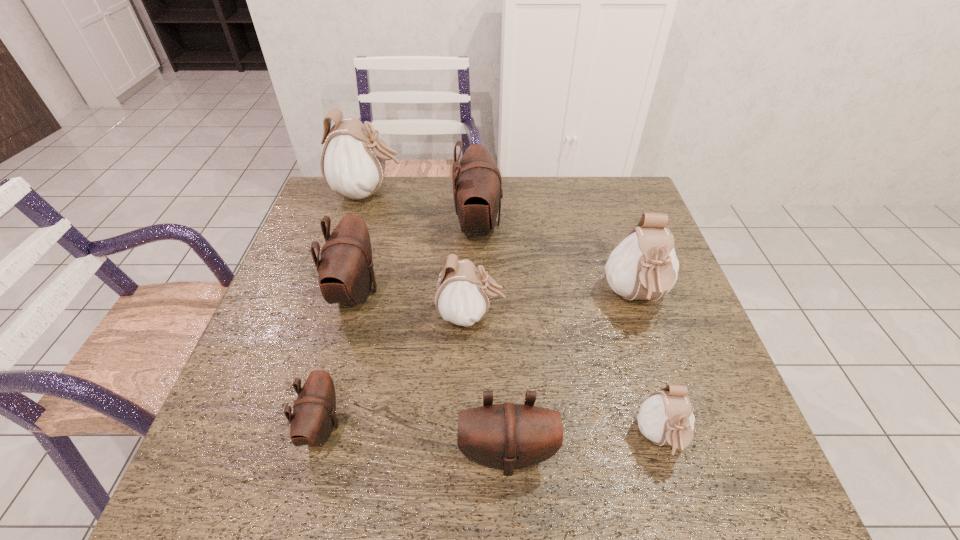
The width and height of the screenshot is (960, 540). I want to click on blank area at the right edge, so click(632, 228).

Where is `free spot at the far left corner of the desktop`? free spot at the far left corner of the desktop is located at coordinates (319, 199).

This screenshot has width=960, height=540. In the image, there is a desktop. Find the location of `blank space at the near right corner`. blank space at the near right corner is located at coordinates (762, 480).

The width and height of the screenshot is (960, 540). I want to click on free space between the nearest white pouch and the third smallest white pouch, so click(648, 368).

In order to click on free area in between the smallest brown pouch and the second farthest brown pouch in this screenshot , I will do `click(339, 359)`.

Locate an element on the screen. free spot between the smallest brown pouch and the third biggest brown pouch is located at coordinates (415, 440).

Locate an element on the screen. The width and height of the screenshot is (960, 540). vacant point located between the leftmost white pouch and the third biggest white pouch is located at coordinates (420, 254).

The height and width of the screenshot is (540, 960). I want to click on free point between the farthest brown pouch and the third smallest white pouch, so click(x=557, y=261).

Find the location of a particular element. This screenshot has width=960, height=540. free space between the third smallest white pouch and the nearest white pouch is located at coordinates (648, 368).

I want to click on vacant point located between the third biggest brown pouch and the farthest white pouch, so click(438, 323).